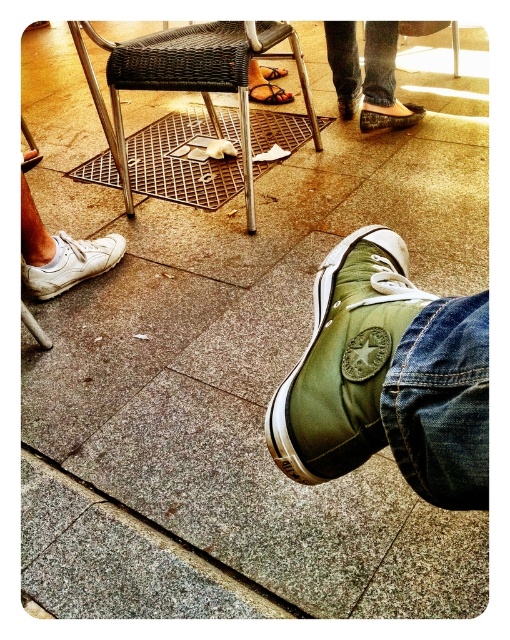
What do you see at coordinates (58, 246) in the screenshot?
I see `white canvas shoe at lower left` at bounding box center [58, 246].

Is white canvas shoe at lower left thinner than matte olive green shoe at center?

Yes.

The height and width of the screenshot is (640, 510). What do you see at coordinates (58, 246) in the screenshot? I see `white canvas shoe at lower left` at bounding box center [58, 246].

You are a GUI agent. You are given a task and a screenshot of the screen. Output one action in this format:
    pyautogui.click(x=<x>, y=<y>)
    Task: Click on the white canvas shoe at lower left
    This screenshot has height=640, width=510.
    Given the screenshot: What is the action you would take?
    pyautogui.click(x=58, y=246)

Measure the distance from white canvas shoe at lower left to brown leather sandal at center.

The distance of white canvas shoe at lower left from brown leather sandal at center is 4.09 feet.

Which is more to the left, white canvas shoe at lower left or brown leather sandal at center?

white canvas shoe at lower left is more to the left.

Find the location of a particular element. This screenshot has height=640, width=510. white canvas shoe at lower left is located at coordinates 58,246.

Is white leather shoe at lower left below brown leather sandal at center?

Yes.

From the picture: Who is positioned more to the left, white leather shoe at lower left or brown leather sandal at center?

white leather shoe at lower left

This screenshot has width=510, height=640. Find the location of `white leather shoe at lower left`. white leather shoe at lower left is located at coordinates click(x=71, y=262).